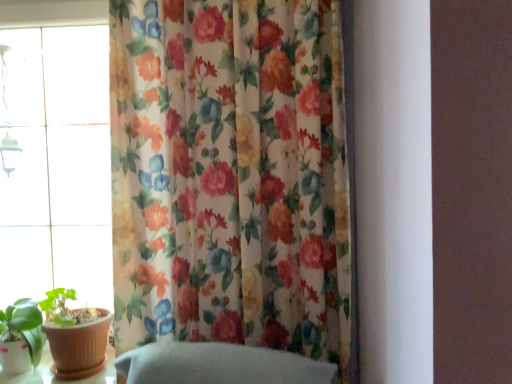
Question: Should I look upward or downward to see floral fabric curtain at center?

Choices:
 (A) up
 (B) down

Answer: (B)

Question: From the image's perspective, is green matte leaf at lower left over transparent glass window at left?

Choices:
 (A) yes
 (B) no

Answer: (B)

Question: From a real-world perspective, does green matte leaf at lower left sit lower than transparent glass window at left?

Choices:
 (A) yes
 (B) no

Answer: (A)

Question: Is green matte leaf at lower left at the left side of transparent glass window at left?

Choices:
 (A) no
 (B) yes

Answer: (B)

Question: From the image's perspective, would you say green matte leaf at lower left is shown under transparent glass window at left?

Choices:
 (A) no
 (B) yes

Answer: (B)

Question: Considering the relative positions of green matte leaf at lower left and transparent glass window at left in the image provided, is green matte leaf at lower left to the right of transparent glass window at left from the viewer's perspective?

Choices:
 (A) no
 (B) yes

Answer: (A)

Question: Is green matte leaf at lower left wider than transparent glass window at left?

Choices:
 (A) yes
 (B) no

Answer: (A)

Question: Is the position of green matte leaf at lower left less distant than that of floral fabric curtain at center?

Choices:
 (A) no
 (B) yes

Answer: (A)

Question: Does green matte leaf at lower left have a greater height compared to floral fabric curtain at center?

Choices:
 (A) yes
 (B) no

Answer: (B)

Question: From a real-world perspective, is green matte leaf at lower left on top of floral fabric curtain at center?

Choices:
 (A) yes
 (B) no

Answer: (B)

Question: Is green matte leaf at lower left turned away from floral fabric curtain at center?

Choices:
 (A) yes
 (B) no

Answer: (B)

Question: Considering the relative positions of green matte leaf at lower left and floral fabric curtain at center in the image provided, is green matte leaf at lower left to the left of floral fabric curtain at center from the viewer's perspective?

Choices:
 (A) no
 (B) yes

Answer: (B)

Question: From the image's perspective, is green matte leaf at lower left over floral fabric curtain at center?

Choices:
 (A) no
 (B) yes

Answer: (A)

Question: From the image's perspective, does transparent glass window at left appear higher than floral fabric curtain at center?

Choices:
 (A) yes
 (B) no

Answer: (A)